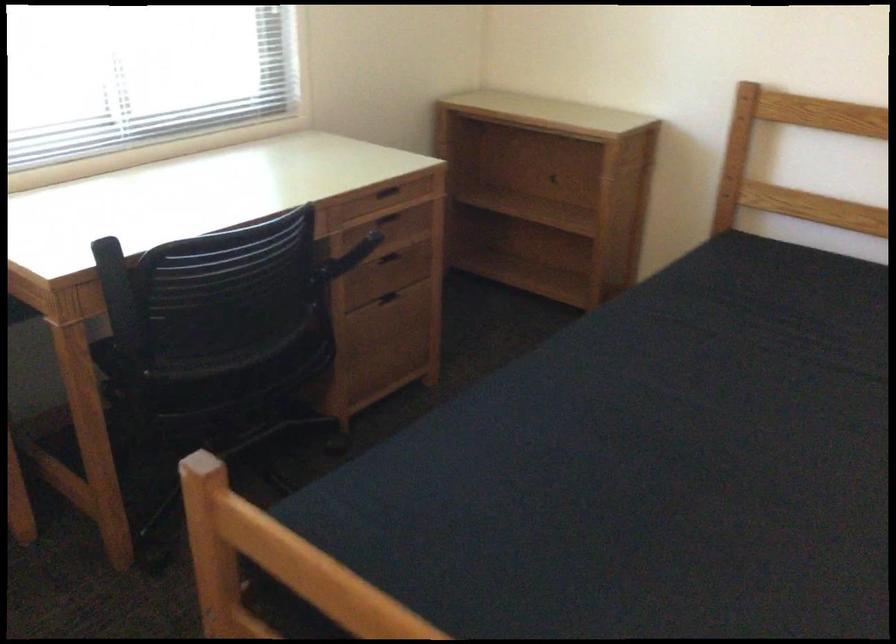
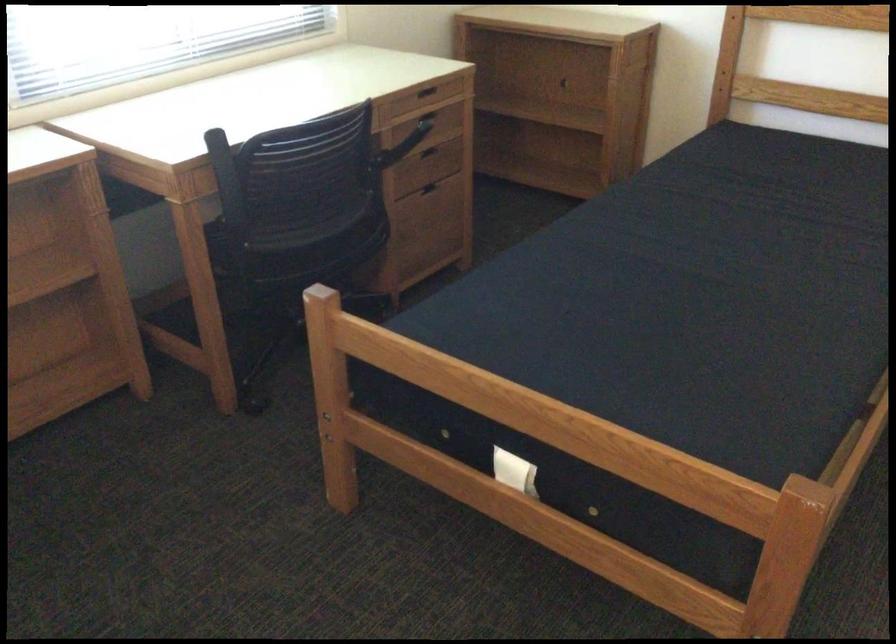
Find the pixel in the second image that matches (383,193) in the first image.

(424, 91)